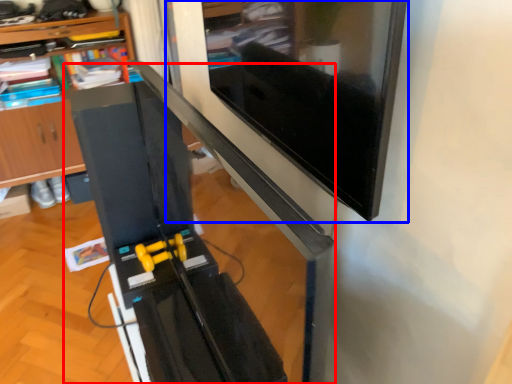
Question: Which object is closer to the camera taking this photo, computer desk (highlighted by a red box) or computer monitor (highlighted by a blue box)?

Choices:
 (A) computer desk
 (B) computer monitor

Answer: (A)